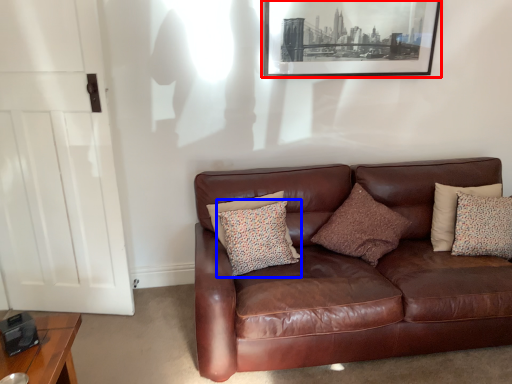
Question: Which object appears closest to the camera in this image, picture frame (highlighted by a red box) or pillow (highlighted by a blue box)?

Choices:
 (A) picture frame
 (B) pillow

Answer: (B)